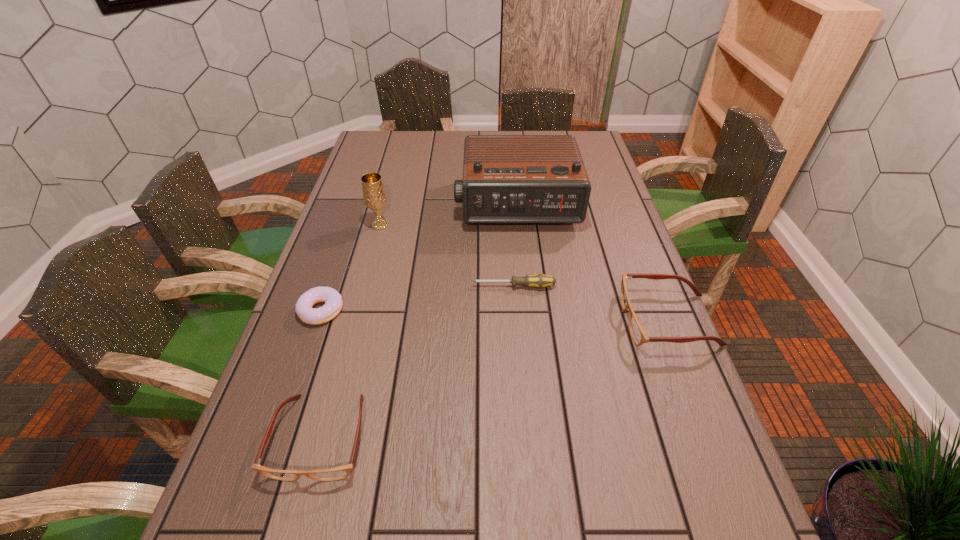
What are the coordinates of `the fourth closest object relative to the shorter spectacles` in the screenshot? It's located at (506, 178).

At what (x,y) coordinates should I click in order to perform the action: click on the closest object to the taller spectacles. Please return your answer as a coordinate pair (x, y). Looking at the image, I should click on (539, 281).

The image size is (960, 540). Find the location of `free space in the image that satisfies the following two spatial constraints: 1. on the front-facing side of the right spectacles; 2. on the front-facing side of the nearer spectacles`. free space in the image that satisfies the following two spatial constraints: 1. on the front-facing side of the right spectacles; 2. on the front-facing side of the nearer spectacles is located at coordinates (714, 437).

This screenshot has height=540, width=960. Identify the location of vacant region that satisfies the following two spatial constraints: 1. on the front-facing side of the farther spectacles; 2. on the front-facing side of the left spectacles. (714, 437).

Identify the location of free space that satisfies the following two spatial constraints: 1. at the tip of the screwdriver; 2. on the front-facing side of the shorter spectacles. (524, 437).